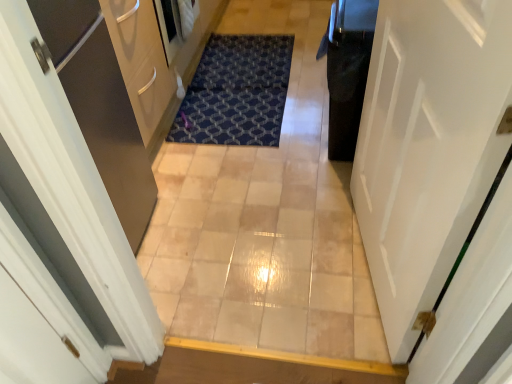
Looking at this image, measure the distance between black glossy trash can at right and camera.

black glossy trash can at right is 1.44 meters away from camera.

What do you see at coordinates (236, 92) in the screenshot?
I see `blue textured mat at center` at bounding box center [236, 92].

Locate an element on the screen. This screenshot has height=384, width=512. black glossy trash can at right is located at coordinates (348, 71).

From the image's perspective, is white glossy door at right above black glossy trash can at right?

No, from the image's perspective, white glossy door at right is not on top of black glossy trash can at right.

Is white glossy door at right to the left of black glossy trash can at right from the viewer's perspective?

Yes.

The image size is (512, 384). I want to click on dark above the white glossy door at right (from the image's perspective), so coord(348,71).

From a real-world perspective, is white glossy door at right beneath black glossy trash can at right?

No, from a real-world perspective, white glossy door at right is not beneath black glossy trash can at right.

Does blue textured mat at center have a smaller size compared to beige tile corridor at center?

Correct, blue textured mat at center occupies less space than beige tile corridor at center.

Between blue textured mat at center and beige tile corridor at center, which one has smaller width?

With smaller width is blue textured mat at center.

From the image's perspective, which object appears higher, blue textured mat at center or beige tile corridor at center?

blue textured mat at center, from the image's perspective.

Which object is further away from the camera, white glossy door at right or blue textured mat at center?

blue textured mat at center.

Does white glossy door at right have a larger size compared to blue textured mat at center?

Yes.

In the scene shown: Which of these two, white glossy door at right or blue textured mat at center, is thinner?

white glossy door at right is thinner.

Are white glossy door at right and blue textured mat at center making contact?

No, white glossy door at right is not with blue textured mat at center.

From a real-world perspective, is beige tile corridor at center below blue textured mat at center?

Indeed, from a real-world perspective, beige tile corridor at center is positioned beneath blue textured mat at center.

Is beige tile corridor at center positioned beyond the bounds of blue textured mat at center?

Indeed, beige tile corridor at center is completely outside blue textured mat at center.

From the picture: In terms of height, does beige tile corridor at center look taller or shorter compared to blue textured mat at center?

beige tile corridor at center is shorter than blue textured mat at center.

Between black glossy trash can at right and white glossy door at right, which one is positioned in front?

white glossy door at right.

Find the location of a particular element. This screenshot has width=512, height=384. door that is on the left side of black glossy trash can at right is located at coordinates [x=428, y=146].

Considering the sizes of black glossy trash can at right and white glossy door at right in the image, is black glossy trash can at right taller or shorter than white glossy door at right?

Clearly, black glossy trash can at right is shorter compared to white glossy door at right.

Can you see black glossy trash can at right touching white glossy door at right?

black glossy trash can at right and white glossy door at right are not in contact.

Which is behind, beige tile corridor at center or black glossy trash can at right?

black glossy trash can at right is behind.

Considering the sizes of objects beige tile corridor at center and black glossy trash can at right in the image provided, who is taller, beige tile corridor at center or black glossy trash can at right?

Standing taller between the two is black glossy trash can at right.

Image resolution: width=512 pixels, height=384 pixels. What are the coordinates of `corridor in front of the black glossy trash can at right` in the screenshot? It's located at (x=265, y=222).

From a real-world perspective, is beige tile corridor at center physically above black glossy trash can at right?

Actually, beige tile corridor at center is physically below black glossy trash can at right in the real world.

Can you confirm if white glossy door at right is positioned to the left of beige tile corridor at center?

Incorrect, white glossy door at right is not on the left side of beige tile corridor at center.

From the image's perspective, is white glossy door at right located above or below beige tile corridor at center?

A: Clearly, from the image's perspective, white glossy door at right is below beige tile corridor at center.

How many degrees apart are the facing directions of white glossy door at right and beige tile corridor at center?

The facing directions of white glossy door at right and beige tile corridor at center are 99 degrees apart.

Is white glossy door at right with beige tile corridor at center?

No, white glossy door at right is not making contact with beige tile corridor at center.

Where is `dark directly beneath the white glossy door at right (from a real-world perspective)`? This screenshot has width=512, height=384. dark directly beneath the white glossy door at right (from a real-world perspective) is located at coordinates (348, 71).

The image size is (512, 384). What are the coordinates of `corridor to the right of blue textured mat at center` in the screenshot? It's located at (265, 222).

Based on their spatial positions, is beige tile corridor at center or white glossy door at right further from black glossy trash can at right?

Based on the image, white glossy door at right appears to be further to black glossy trash can at right.

Considering their positions, is black glossy trash can at right positioned closer to beige tile corridor at center than blue textured mat at center?

blue textured mat at center is positioned closer to the anchor beige tile corridor at center.

When comparing their distances from blue textured mat at center, does white glossy door at right or beige tile corridor at center seem closer?

beige tile corridor at center is closer to blue textured mat at center.

Based on their spatial positions, is white glossy door at right or black glossy trash can at right closer to beige tile corridor at center?

black glossy trash can at right lies closer to beige tile corridor at center than the other object.

When comparing their distances from white glossy door at right, does black glossy trash can at right or beige tile corridor at center seem further?

beige tile corridor at center.

Looking at the image, which one is located closer to blue textured mat at center, white glossy door at right or black glossy trash can at right?

black glossy trash can at right.

In the scene shown: Based on their spatial positions, is blue textured mat at center or white glossy door at right closer to black glossy trash can at right?

The object closer to black glossy trash can at right is white glossy door at right.

From the image, which object appears to be nearer to beige tile corridor at center, blue textured mat at center or black glossy trash can at right?

Based on the image, blue textured mat at center appears to be nearer to beige tile corridor at center.

Identify the location of dark between white glossy door at right and blue textured mat at center in the front-back direction. click(x=348, y=71).

Image resolution: width=512 pixels, height=384 pixels. Find the location of `dark between beige tile corridor at center and blue textured mat at center along the z-axis`. dark between beige tile corridor at center and blue textured mat at center along the z-axis is located at coordinates (348, 71).

This screenshot has width=512, height=384. I want to click on corridor positioned between white glossy door at right and black glossy trash can at right from near to far, so click(x=265, y=222).

Find the location of a particular element. corridor between white glossy door at right and blue textured mat at center from front to back is located at coordinates (265, 222).